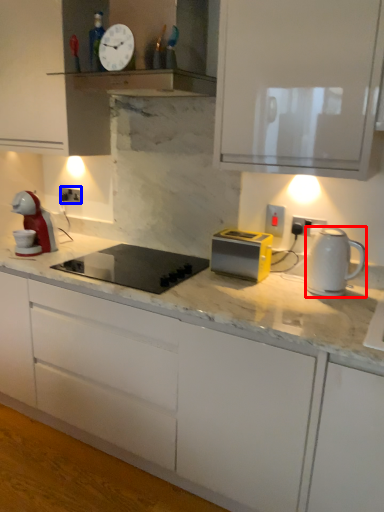
Question: Which object appears closest to the camera in this image, kitchen appliance (highlighted by a red box) or electric outlet (highlighted by a blue box)?

Choices:
 (A) kitchen appliance
 (B) electric outlet

Answer: (A)